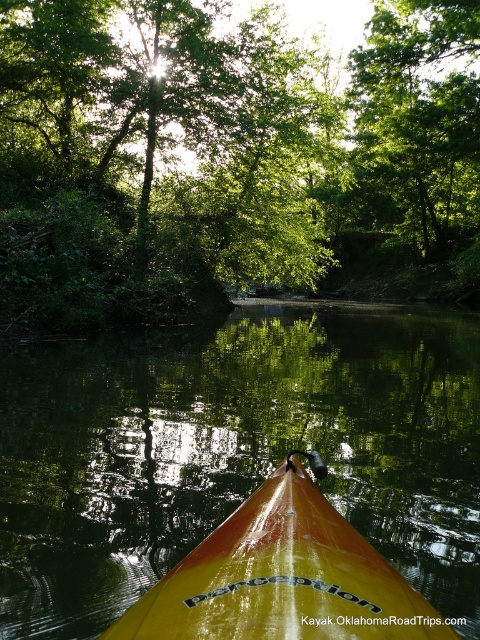
Can you confirm if yellow glossy kayak at lower center is thinner than yellow glossy kayak at center?

No.

Is point (411, 369) closer to camera compared to point (211, 632)?

That is False.

What do you see at coordinates (233, 451) in the screenshot? This screenshot has width=480, height=640. I see `yellow glossy kayak at lower center` at bounding box center [233, 451].

The image size is (480, 640). What are the coordinates of `yellow glossy kayak at lower center` in the screenshot? It's located at (233, 451).

Which is above, yellow glossy kayak at center or green leafy tree at upper center?

green leafy tree at upper center is higher up.

Looking at this image, who is more distant from viewer, (259, 544) or (384, 198)?

The point (384, 198) is more distant.

Which is in front, point (416, 620) or point (444, 184)?

Point (416, 620) is in front.

Where is `yellow glossy kayak at center`? yellow glossy kayak at center is located at coordinates (283, 579).

Is green leafy trees at center thinner than yellow glossy kayak at lower center?

No, green leafy trees at center is not thinner than yellow glossy kayak at lower center.

Is point (309, 108) closer to viewer compared to point (62, 410)?

No, it is not.

Find the location of a particular element. The width and height of the screenshot is (480, 640). green leafy trees at center is located at coordinates (231, 157).